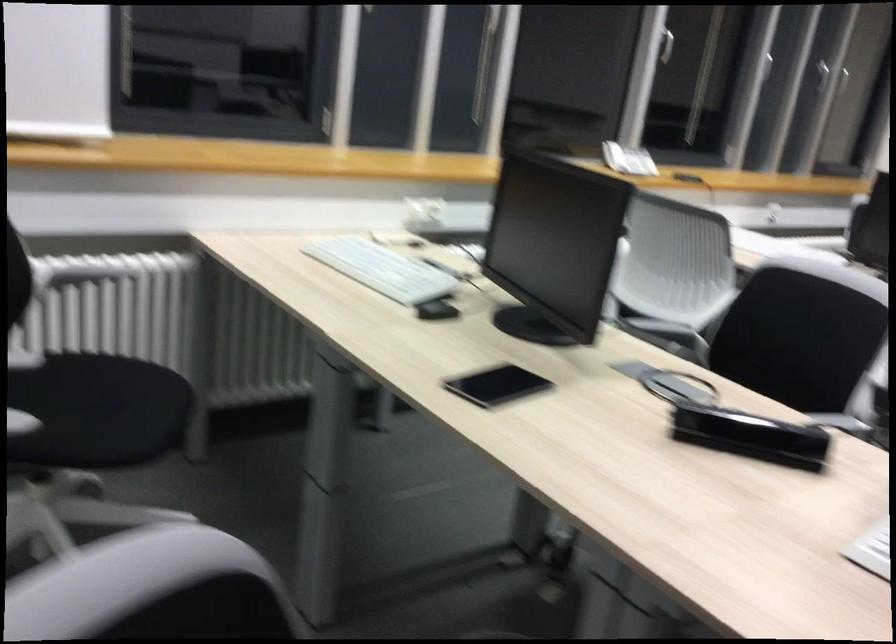
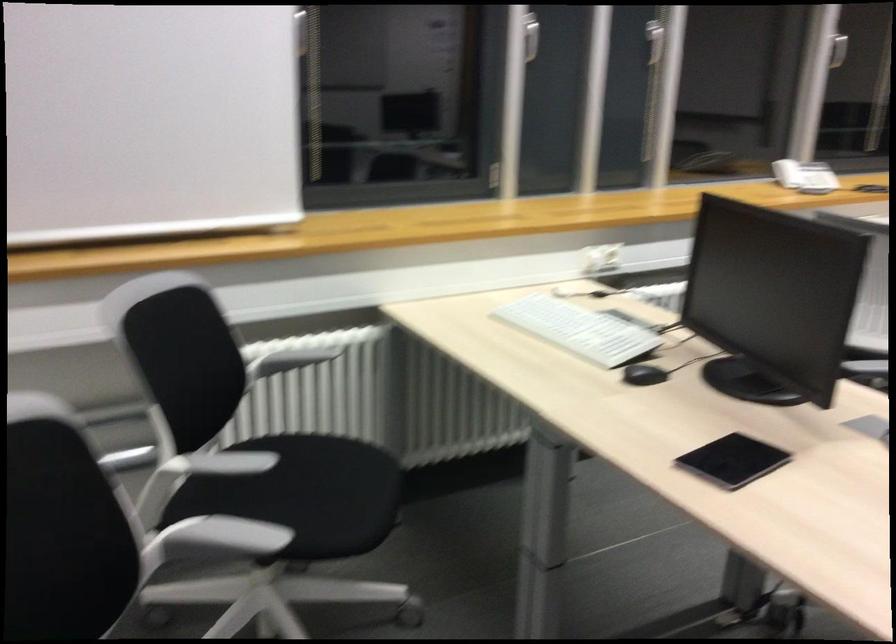
Question: Which direction would the cameraman need to move to produce the second image? Reply with the corresponding letter.

Choices:
 (A) Left
 (B) Right
 (C) Forward
 (D) Backward

Answer: (A)